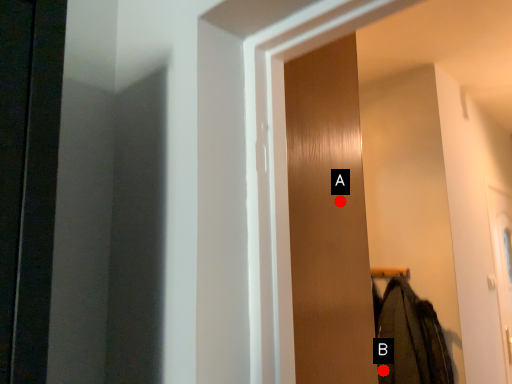
Question: Two points are circled on the image, labeled by A and B beside each circle. Among these points, which one is farthest from the camera?

Choices:
 (A) A is further
 (B) B is further

Answer: (B)